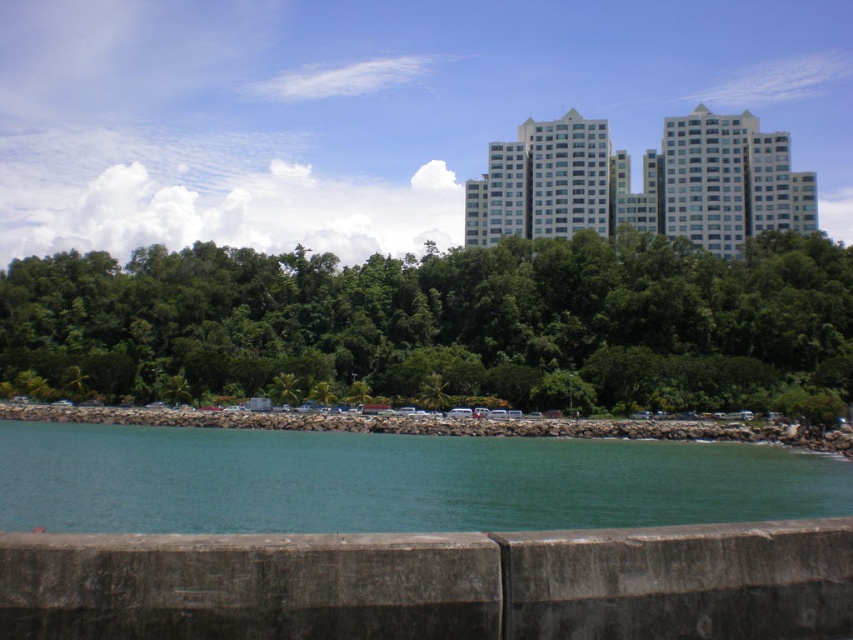
Which of these two, green leafy trees at center or white glossy building at upper center, stands taller?

white glossy building at upper center is taller.

Looking at this image, which is more to the right, green leafy trees at center or white glossy building at upper center?

From the viewer's perspective, white glossy building at upper center appears more on the right side.

Based on the photo, measure the distance between green leafy trees at center and camera.

green leafy trees at center is 326.17 feet away from camera.

Where is `green leafy trees at center`? This screenshot has height=640, width=853. green leafy trees at center is located at coordinates (419, 310).

Does green leafy trees at center appear on the right side of concrete at lower center?

In fact, green leafy trees at center is to the left of concrete at lower center.

Can you confirm if green leafy trees at center is smaller than concrete at lower center?

Incorrect, green leafy trees at center is not smaller in size than concrete at lower center.

The height and width of the screenshot is (640, 853). I want to click on green leafy trees at center, so click(x=419, y=310).

Identify the location of concrete at lower center. (434, 584).

Is concrete at lower center thinner than teal water at lower center?

Correct, concrete at lower center's width is less than teal water at lower center's.

Which is behind, point (207, 582) or point (277, 529)?

Point (277, 529)

Find the location of `concrete at lower center`. concrete at lower center is located at coordinates (434, 584).